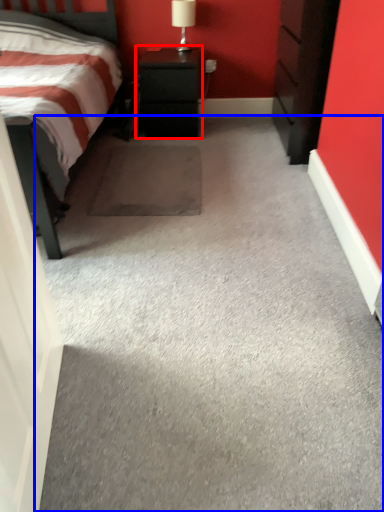
Question: Which point is closer to the camera, nightstand (highlighted by a red box) or concrete (highlighted by a blue box)?

Choices:
 (A) nightstand
 (B) concrete

Answer: (B)